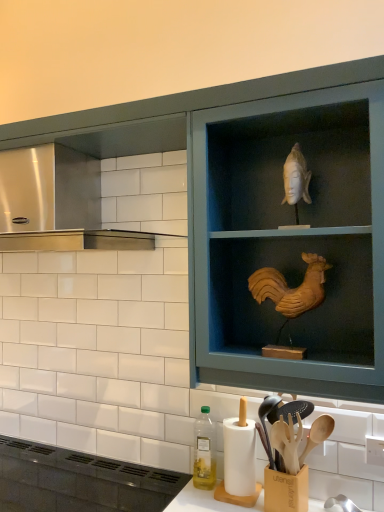
Question: From a real-world perspective, is wooden rooster at upper right positioned above or below matte black vent at lower left?

Choices:
 (A) below
 (B) above

Answer: (B)

Question: Looking at the image, does wooden rooster at upper right seem bigger or smaller compared to matte black vent at lower left?

Choices:
 (A) big
 (B) small

Answer: (A)

Question: Which of these objects is positioned farthest from the wooden spoons at lower center?

Choices:
 (A) matte black vent at lower left
 (B) stainless steel vent at upper left
 (C) wooden rooster at upper right
 (D) translucent plastic bottle at lower center
 (E) wooden cabinet at upper center

Answer: (B)

Question: Considering the real-world distances, which object is closest to the translucent plastic bottle at lower center?

Choices:
 (A) stainless steel vent at upper left
 (B) wooden spoons at lower center
 (C) wooden cabinet at upper center
 (D) wooden rooster at upper right
 (E) matte black vent at lower left

Answer: (B)